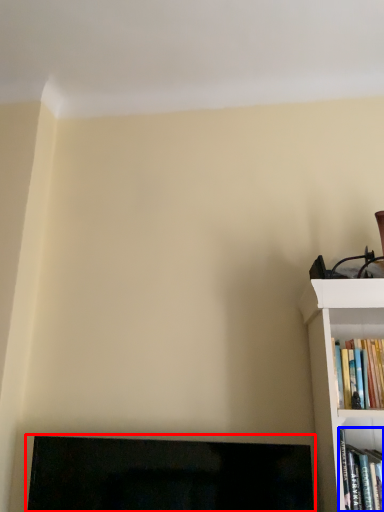
Question: Which object is closer to the camera taking this photo, fireplace (highlighted by a red box) or book (highlighted by a blue box)?

Choices:
 (A) fireplace
 (B) book

Answer: (B)